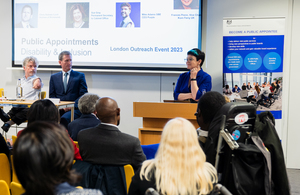
Locate an element on the screen. The image size is (300, 195). wall is located at coordinates (128, 97).